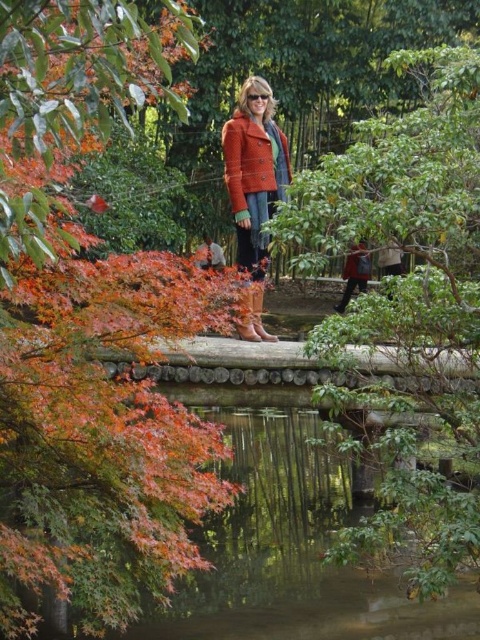
Question: Is brown suede boot at center below light brown leather boots at center?

Choices:
 (A) no
 (B) yes

Answer: (B)

Question: Can you confirm if red fabric backpack at right is smaller than light brown leather boots at center?

Choices:
 (A) yes
 (B) no

Answer: (B)

Question: Which point is farther to the camera?

Choices:
 (A) pos(367,612)
 (B) pos(242,294)

Answer: (A)

Question: Estimate the real-world distances between objects in this image. Which object is farther from the matte orange coat at center?

Choices:
 (A) brown leather boot at center
 (B) light brown leather boots at center

Answer: (B)

Question: Estimate the real-world distances between objects in this image. Which object is closer to the matte orange coat at center?

Choices:
 (A) smooth reflective water at center
 (B) red fabric backpack at right

Answer: (A)

Question: Is smooth reflective water at center to the left of brown suede boot at center from the viewer's perspective?

Choices:
 (A) no
 (B) yes

Answer: (A)